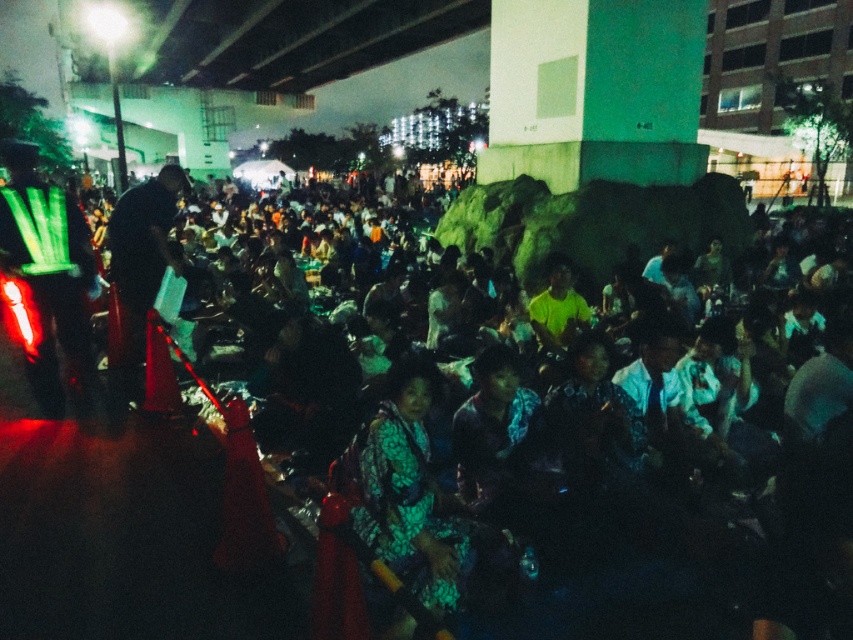
Can you confirm if reflective green vest at left is taller than dark blue fabric at center?

Yes, reflective green vest at left is taller than dark blue fabric at center.

Is point (88, 250) positioned after point (132, 316)?

No, it is not.

Image resolution: width=853 pixels, height=640 pixels. I want to click on reflective green vest at left, so click(49, 276).

Between printed fabric dress at center and reflective green vest at left, which one is positioned higher?

Positioned higher is reflective green vest at left.

Does printed fabric dress at center have a lesser width compared to reflective green vest at left?

No, printed fabric dress at center is not thinner than reflective green vest at left.

Is point (379, 477) farther from camera compared to point (13, 141)?

No, (379, 477) is in front of (13, 141).

Where is `printed fabric dress at center`? printed fabric dress at center is located at coordinates (410, 493).

Which of these two, printed fabric dress at center or dark blue fabric at center, stands taller?

printed fabric dress at center

Who is more distant from viewer, (471, 564) or (142, 289)?

Positioned behind is point (142, 289).

Find the location of a particular element. printed fabric dress at center is located at coordinates (410, 493).

This screenshot has height=640, width=853. What are the coordinates of `printed fabric dress at center` in the screenshot? It's located at (410, 493).